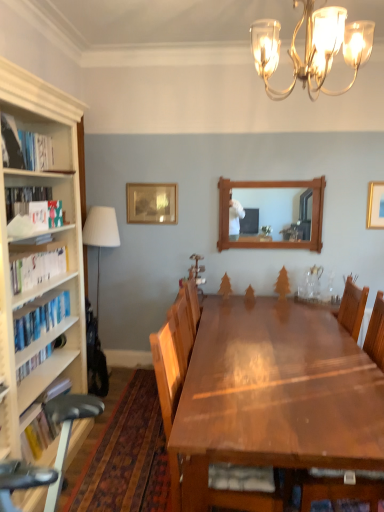
Where is `empty space that is ontop of shiny brown wooden table at center`? The width and height of the screenshot is (384, 512). empty space that is ontop of shiny brown wooden table at center is located at coordinates (287, 366).